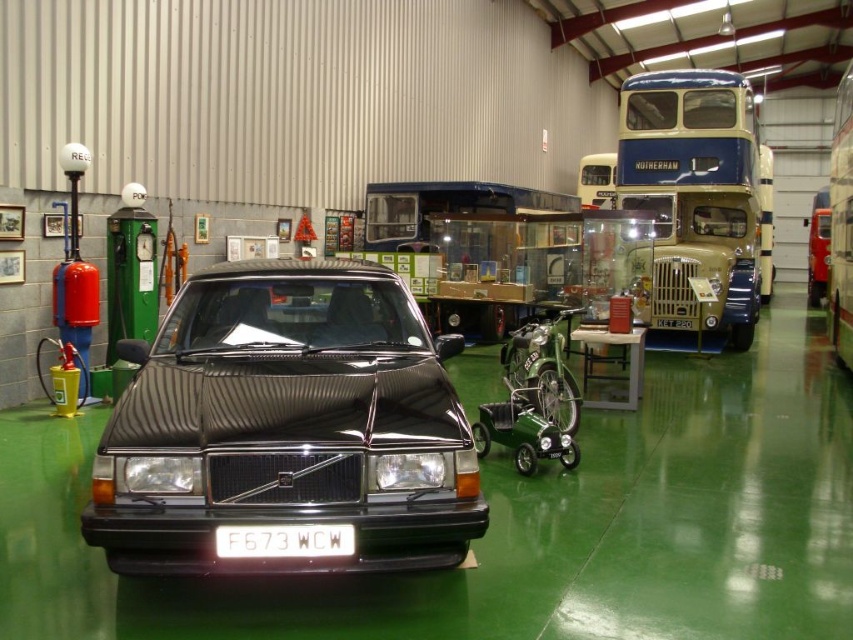
Question: Which is nearer to the shiny black car at center?

Choices:
 (A) white plastic license plate at center
 (B) blue/yellow painted metal/decorative double-decker bus at upper right

Answer: (A)

Question: Does shiny black car at center lie behind white plastic license plate at center?

Choices:
 (A) no
 (B) yes

Answer: (B)

Question: Does blue/yellow painted metal/decorative double-decker bus at upper right have a larger size compared to white plastic license plate at center?

Choices:
 (A) no
 (B) yes

Answer: (B)

Question: Does blue/yellow painted metal/decorative double-decker bus at upper right appear on the right side of white plastic license plate at center?

Choices:
 (A) yes
 (B) no

Answer: (A)

Question: Which point is farther to the camera?

Choices:
 (A) (322, 541)
 (B) (666, 291)
 (C) (315, 328)

Answer: (B)

Question: Among these objects, which one is nearest to the camera?

Choices:
 (A) blue/yellow painted metal/decorative double-decker bus at upper right
 (B) shiny black car at center
 (C) white plastic license plate at center

Answer: (C)